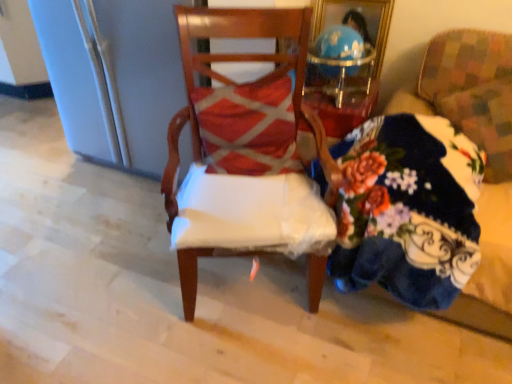
The image size is (512, 384). Identify the location of free region on the left part of wooden chair at center, the second chair from the right. (109, 261).